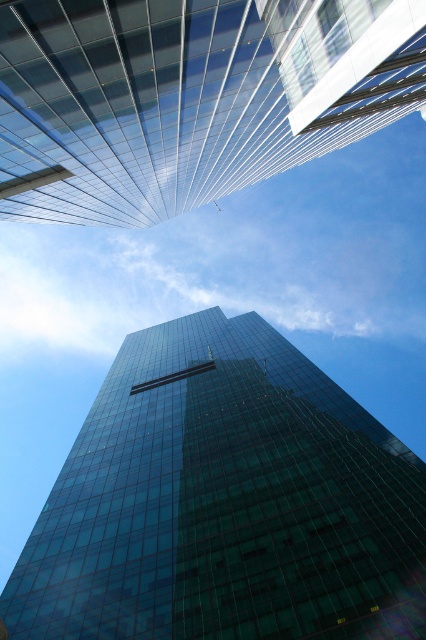
You are standing at the base of the transparent glass tower at center and want to look towards the transparent glass building at upper center. In which direction should you turn your head?

You should turn your head to the right because the transparent glass tower at center is to the left of the transparent glass building at upper center.

You are standing at the base of the transparent glass tower at center and want to compare its size with the transparent glass building at upper center. Which one appears bigger in the image?

The transparent glass tower at center appears bigger than the transparent glass building at upper center in the image because it has a larger size.